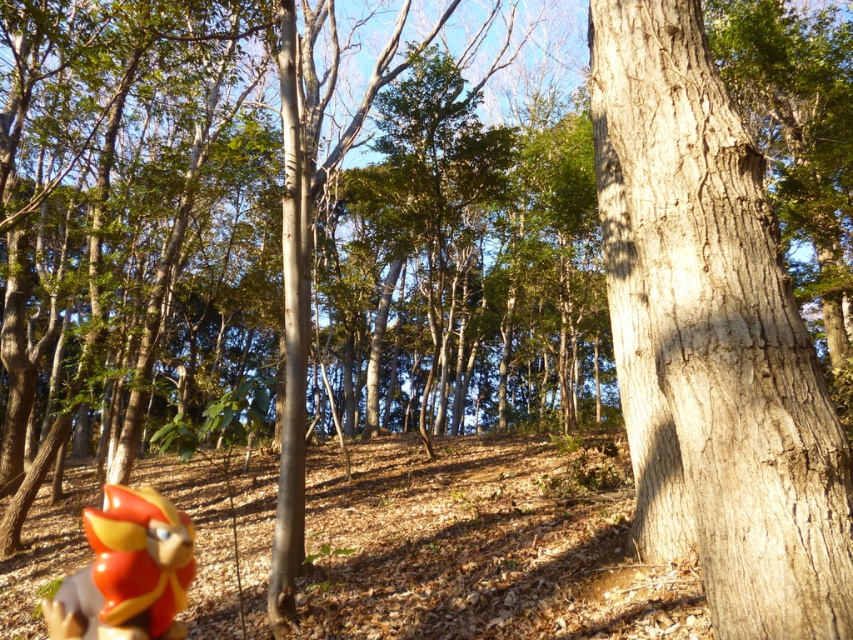
Does smooth gray bark at right have a lesser height compared to shiny plastic bird at lower left?

In fact, smooth gray bark at right may be taller than shiny plastic bird at lower left.

At what (x,y) coordinates should I click in order to perform the action: click on smooth gray bark at right. Please return your answer as a coordinate pair (x, y). Looking at the image, I should click on (712, 339).

Locate an element on the screen. Image resolution: width=853 pixels, height=640 pixels. smooth gray bark at right is located at coordinates (712, 339).